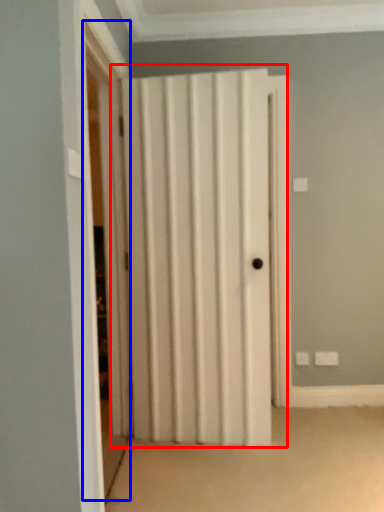
Question: Which point is further to the camera, door (highlighted by a red box) or screen door (highlighted by a blue box)?

Choices:
 (A) door
 (B) screen door

Answer: (A)